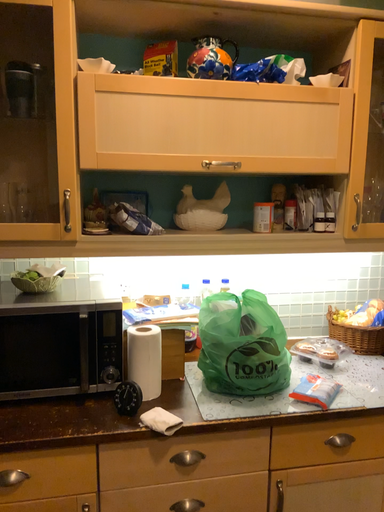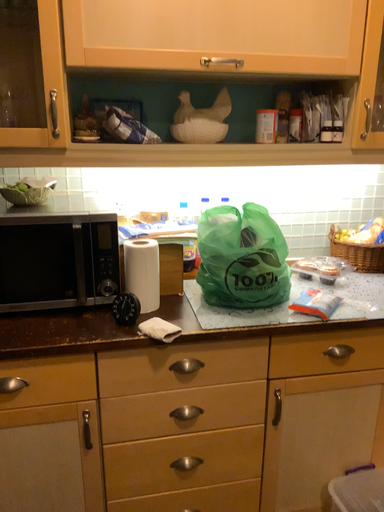
Question: Which way did the camera rotate in the video?

Choices:
 (A) rotated upward
 (B) rotated downward

Answer: (B)